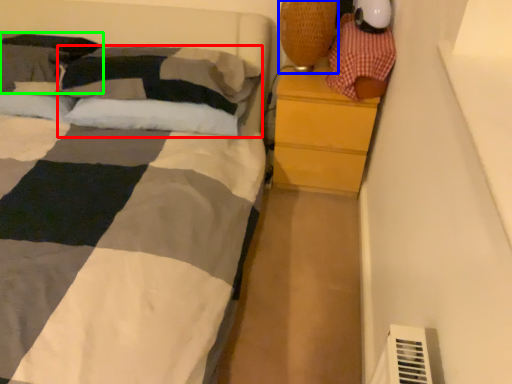
Question: Which object is positioned closest to pillow (highlighted by a red box)? Select from table lamp (highlighted by a blue box) and pillow (highlighted by a green box).

Choices:
 (A) table lamp
 (B) pillow

Answer: (B)